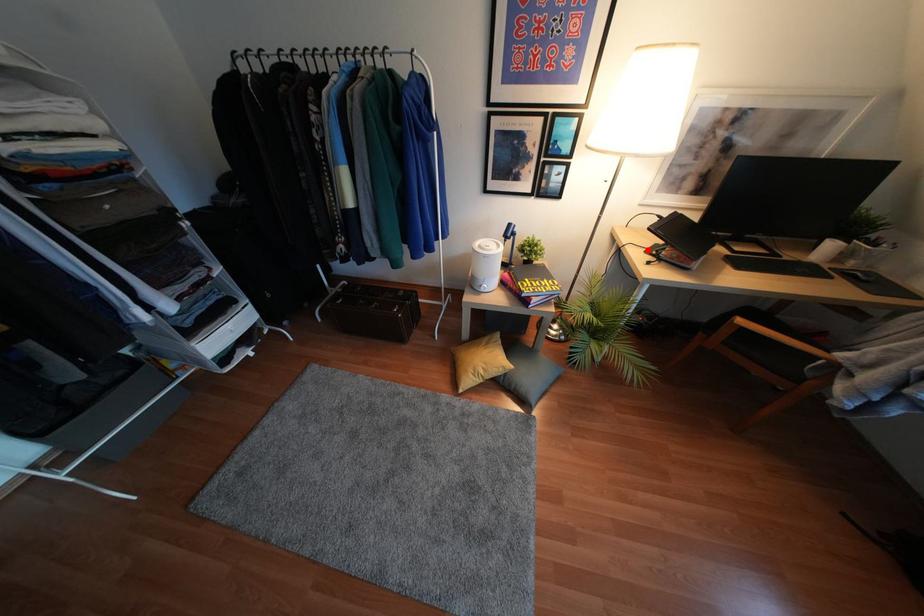
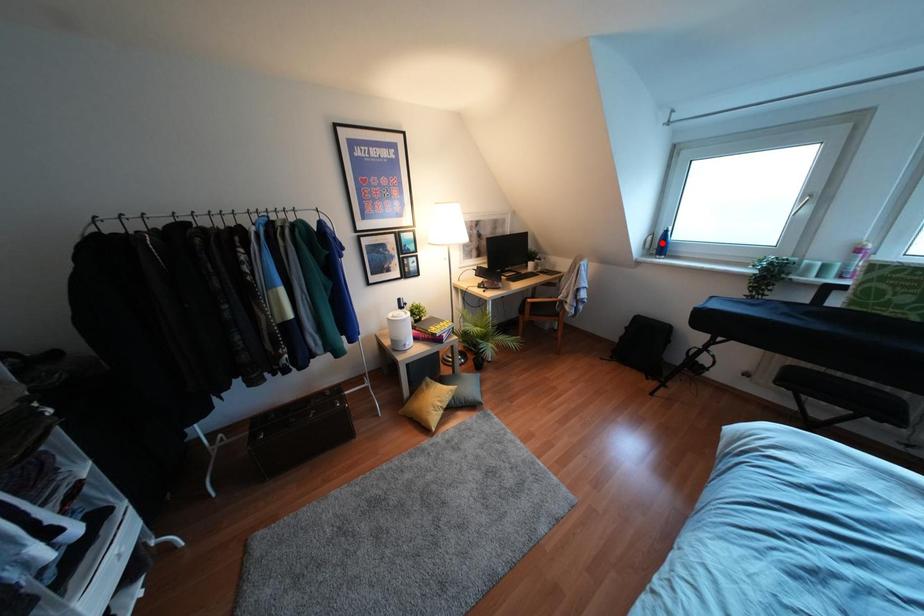
I am providing you with two images of the same scene from different viewpoints. A red point is marked on the first image and another point is marked on the second image. Is the red point in image1 aligned with the point shown in image2?

No